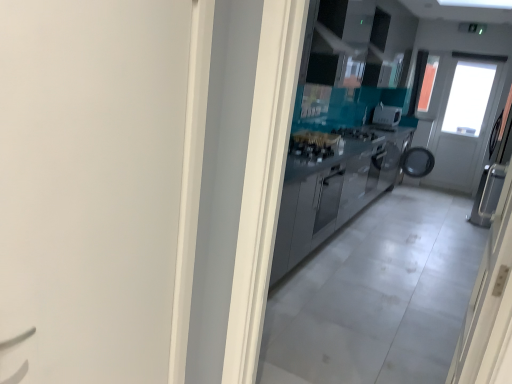
This screenshot has height=384, width=512. In order to click on satin silver cabinetry at center in this screenshot , I will do `click(333, 192)`.

Where is `white matte door at left, which appears as the first door when viewed from the left`? white matte door at left, which appears as the first door when viewed from the left is located at coordinates (90, 186).

From the picture: Measure the distance between white matte door at left, which is the second door from right to left, and camera.

The depth of white matte door at left, which is the second door from right to left, is 29.07 inches.

Describe the element at coordinates (490, 279) in the screenshot. I see `satin silver door at right, acting as the second door starting from the left` at that location.

Where is `satin silver toaster at center`? The image size is (512, 384). satin silver toaster at center is located at coordinates (386, 115).

Considering the relative positions of satin silver cabinetry at center and satin silver door at right, acting as the first door starting from the right, in the image provided, is satin silver cabinetry at center to the left of satin silver door at right, acting as the first door starting from the right, from the viewer's perspective?

Incorrect, satin silver cabinetry at center is not on the left side of satin silver door at right, acting as the first door starting from the right.

How far apart are satin silver cabinetry at center and satin silver door at right, acting as the first door starting from the right?

satin silver cabinetry at center is 2.06 meters away from satin silver door at right, acting as the first door starting from the right.

Between satin silver cabinetry at center and satin silver door at right, acting as the second door starting from the left, which one has more height?

satin silver door at right, acting as the second door starting from the left, is taller.

From the image's perspective, which is below, satin silver cabinetry at center or satin silver door at right, acting as the second door starting from the left?

From the image's view, satin silver door at right, acting as the second door starting from the left, is below.

How different are the orientations of white matte door at left, which appears as the first door when viewed from the left, and satin silver cabinetry at center in degrees?

2.85 degrees.

Does white matte door at left, which is the second door from right to left, have a larger size compared to satin silver cabinetry at center?

No, white matte door at left, which is the second door from right to left, is not bigger than satin silver cabinetry at center.

Measure the distance from white matte door at left, which appears as the first door when viewed from the left, to satin silver cabinetry at center.

6.49 feet.

Is satin silver cabinetry at center inside white matte door at left, which is the second door from right to left?

That's incorrect, satin silver cabinetry at center is not inside white matte door at left, which is the second door from right to left.

Who is more distant, satin silver toaster at center or white matte door at left, which appears as the first door when viewed from the left?

satin silver toaster at center is behind.

Is point (400, 118) closer or farther from the camera than point (100, 324)?

Point (400, 118) is farther from the camera than point (100, 324).

Does satin silver toaster at center have a greater width compared to white matte door at left, which is the second door from right to left?

Indeed, satin silver toaster at center has a greater width compared to white matte door at left, which is the second door from right to left.

Is satin silver toaster at center positioned far away from white matte door at left, which appears as the first door when viewed from the left?

That's right, there is a large distance between satin silver toaster at center and white matte door at left, which appears as the first door when viewed from the left.

Is point (493, 167) more distant than point (375, 117)?

No, (493, 167) is in front of (375, 117).

Between satin silver door at right, acting as the second door starting from the left, and satin silver toaster at center, which one is positioned in front?

satin silver door at right, acting as the second door starting from the left, is more forward.

Considering the relative sizes of satin silver door at right, acting as the first door starting from the right, and satin silver toaster at center in the image provided, is satin silver door at right, acting as the first door starting from the right, wider than satin silver toaster at center?

Incorrect, the width of satin silver door at right, acting as the first door starting from the right, does not surpass that of satin silver toaster at center.

Consider the image. From a real-world perspective, who is located higher, satin silver door at right, acting as the second door starting from the left, or satin silver toaster at center?

satin silver toaster at center, from a real-world perspective.

Is satin silver toaster at center shorter than satin silver cabinetry at center?

Yes.

Is satin silver toaster at center completely or partially outside of satin silver cabinetry at center?

Yes, satin silver toaster at center is outside of satin silver cabinetry at center.

From the image's perspective, relative to satin silver cabinetry at center, is satin silver toaster at center above or below?

satin silver toaster at center is above satin silver cabinetry at center.

Is satin silver toaster at center directly adjacent to satin silver cabinetry at center?

No, satin silver toaster at center is not in contact with satin silver cabinetry at center.

Considering the sizes of satin silver door at right, acting as the second door starting from the left, and white matte door at left, which appears as the first door when viewed from the left, in the image, is satin silver door at right, acting as the second door starting from the left, bigger or smaller than white matte door at left, which appears as the first door when viewed from the left,?

satin silver door at right, acting as the second door starting from the left, is bigger than white matte door at left, which appears as the first door when viewed from the left.

Is satin silver door at right, acting as the second door starting from the left, looking in the opposite direction of white matte door at left, which appears as the first door when viewed from the left?

No, white matte door at left, which appears as the first door when viewed from the left, is not at the back of satin silver door at right, acting as the second door starting from the left.

From a real-world perspective, is satin silver door at right, acting as the first door starting from the right, physically below white matte door at left, which appears as the first door when viewed from the left?

Yes, from a real-world perspective, satin silver door at right, acting as the first door starting from the right, is under white matte door at left, which appears as the first door when viewed from the left.

From a real-world perspective, is satin silver toaster at center over satin silver door at right, acting as the first door starting from the right?

Indeed, from a real-world perspective, satin silver toaster at center stands above satin silver door at right, acting as the first door starting from the right.

From the image's perspective, is satin silver toaster at center located above or below satin silver door at right, acting as the first door starting from the right?

satin silver toaster at center is above satin silver door at right, acting as the first door starting from the right.

Is satin silver door at right, acting as the first door starting from the right, located within satin silver toaster at center?

No, satin silver door at right, acting as the first door starting from the right, is located outside of satin silver toaster at center.

This screenshot has height=384, width=512. I want to click on cabinetry located on the right of satin silver door at right, acting as the first door starting from the right, so click(333, 192).

Which door is the 2nd one when counting from the left side of the satin silver cabinetry at center? Please provide its 2D coordinates.

[(90, 186)]

Considering their positions, is white matte door at left, which is the second door from right to left, positioned further to satin silver cabinetry at center than satin silver door at right, acting as the first door starting from the right?

Among the two, satin silver door at right, acting as the first door starting from the right, is located further to satin silver cabinetry at center.

Based on their spatial positions, is satin silver cabinetry at center or satin silver toaster at center further from white matte door at left, which appears as the first door when viewed from the left?

satin silver toaster at center is positioned further to the anchor white matte door at left, which appears as the first door when viewed from the left.

Which object lies nearer to the anchor point satin silver toaster at center, satin silver cabinetry at center or satin silver door at right, acting as the second door starting from the left?

satin silver cabinetry at center.

Considering their positions, is satin silver door at right, acting as the first door starting from the right, positioned closer to satin silver toaster at center than satin silver cabinetry at center?

Based on the image, satin silver cabinetry at center appears to be nearer to satin silver toaster at center.

Which object lies nearer to the anchor point white matte door at left, which is the second door from right to left, satin silver toaster at center or satin silver door at right, acting as the second door starting from the left?

satin silver door at right, acting as the second door starting from the left, is closer to white matte door at left, which is the second door from right to left.

Looking at the image, which one is located closer to white matte door at left, which appears as the first door when viewed from the left, satin silver cabinetry at center or satin silver door at right, acting as the first door starting from the right?

Based on the image, satin silver door at right, acting as the first door starting from the right, appears to be nearer to white matte door at left, which appears as the first door when viewed from the left.

From the picture: Looking at the image, which one is located further to satin silver cabinetry at center, satin silver door at right, acting as the first door starting from the right, or satin silver toaster at center?

Based on the image, satin silver toaster at center appears to be further to satin silver cabinetry at center.

Considering their positions, is satin silver cabinetry at center positioned closer to satin silver door at right, acting as the first door starting from the right, than satin silver toaster at center?

satin silver cabinetry at center.

Identify the location of cabinetry between satin silver door at right, acting as the second door starting from the left, and satin silver toaster at center in the front-back direction. The height and width of the screenshot is (384, 512). (333, 192).

The width and height of the screenshot is (512, 384). What are the coordinates of `door between white matte door at left, which appears as the first door when viewed from the left, and satin silver toaster at center from front to back` in the screenshot? It's located at (490, 279).

Locate an element on the screen. The height and width of the screenshot is (384, 512). cabinetry between white matte door at left, which appears as the first door when viewed from the left, and satin silver toaster at center from front to back is located at coordinates (333, 192).

Locate an element on the screen. The image size is (512, 384). door positioned between white matte door at left, which appears as the first door when viewed from the left, and satin silver cabinetry at center from near to far is located at coordinates (490, 279).